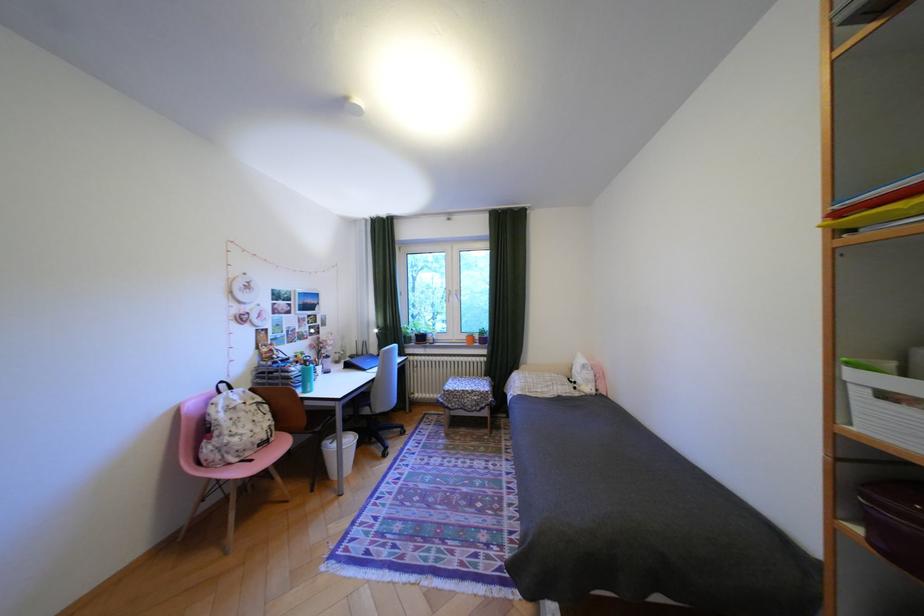
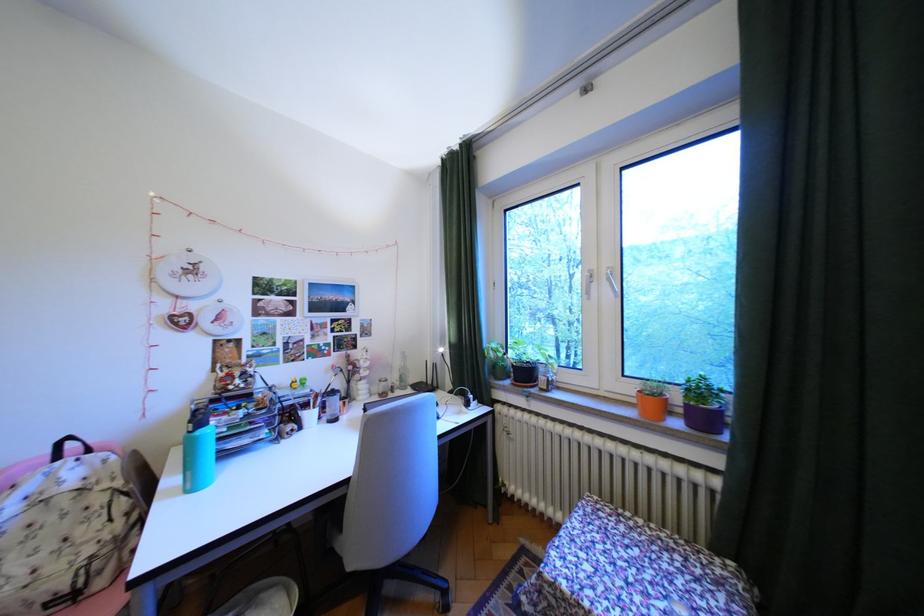
Locate, in the second image, the point that corresponds to pixel 476 337 in the first image.

(641, 390)